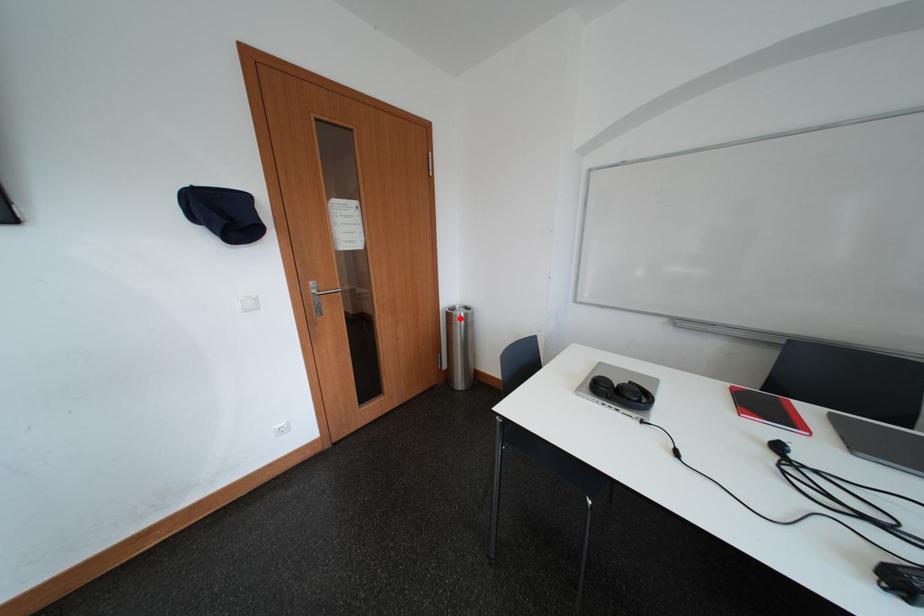
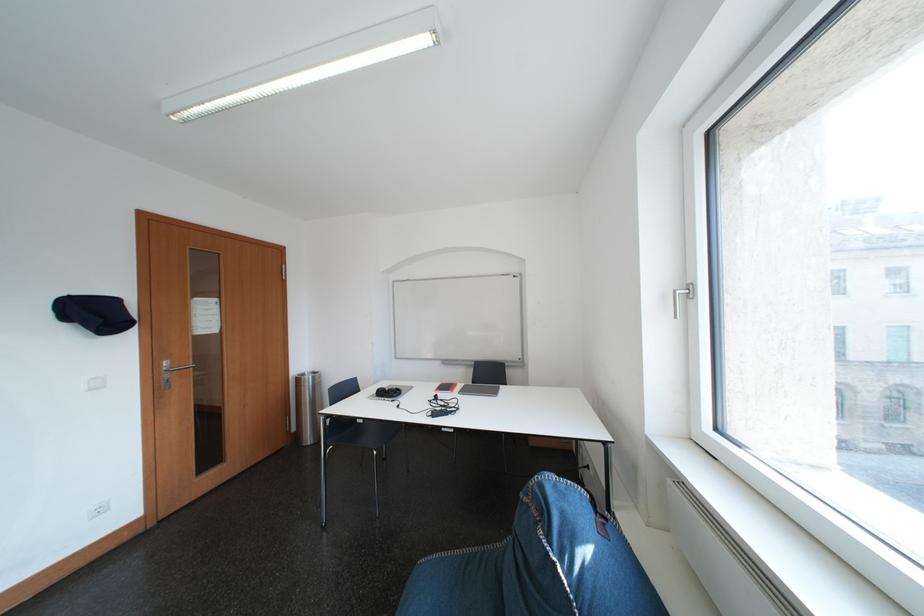
Question: I am providing you with two images of the same scene from different viewpoints. In image1, a red point is highlighted. Considering the same 3D point in image2, which of the following is correct?

Choices:
 (A) It is closer
 (B) It is farther

Answer: (B)